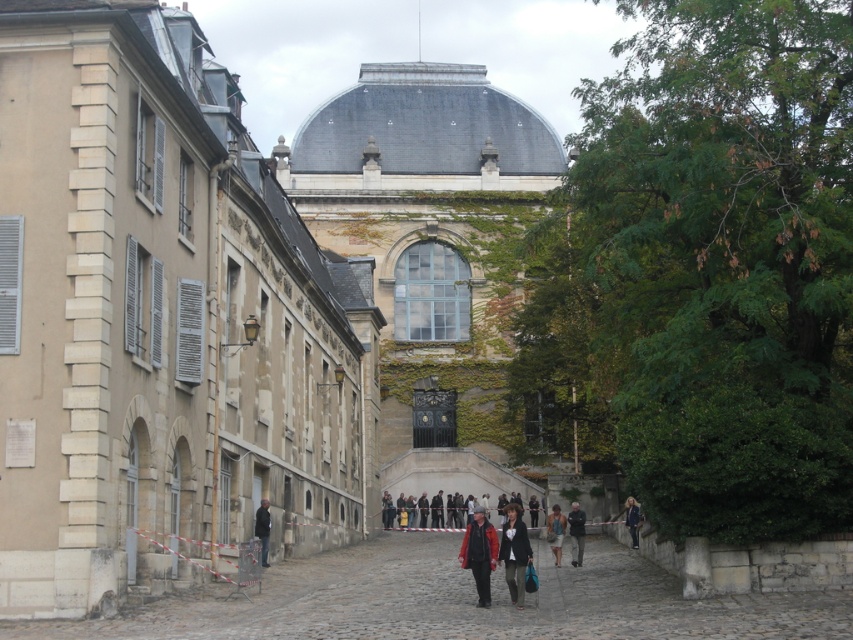
Does denim jacket at lower center have a lesser width compared to dark brown leather jacket at lower right?

No, denim jacket at lower center is not thinner than dark brown leather jacket at lower right.

Can you confirm if denim jacket at lower center is positioned below dark brown leather jacket at lower right?

Yes, denim jacket at lower center is below dark brown leather jacket at lower right.

Between point (515, 513) and point (634, 524), which one is positioned behind?

The point (634, 524) is more distant.

Where is `denim jacket at lower center`? The width and height of the screenshot is (853, 640). denim jacket at lower center is located at coordinates (514, 552).

Between matte black jacket at center and dark brown leather jacket at lower right, which one appears on the left side from the viewer's perspective?

matte black jacket at center

Where is `matte black jacket at center`? The image size is (853, 640). matte black jacket at center is located at coordinates (479, 552).

Is point (39, 477) positioned behind point (518, 506)?

No, (39, 477) is in front of (518, 506).

Can you confirm if beige stone building at left is positioned below denim jacket at lower center?

No.

Where is `beige stone building at left`? beige stone building at left is located at coordinates (160, 321).

Locate an element on the screen. beige stone building at left is located at coordinates (160, 321).